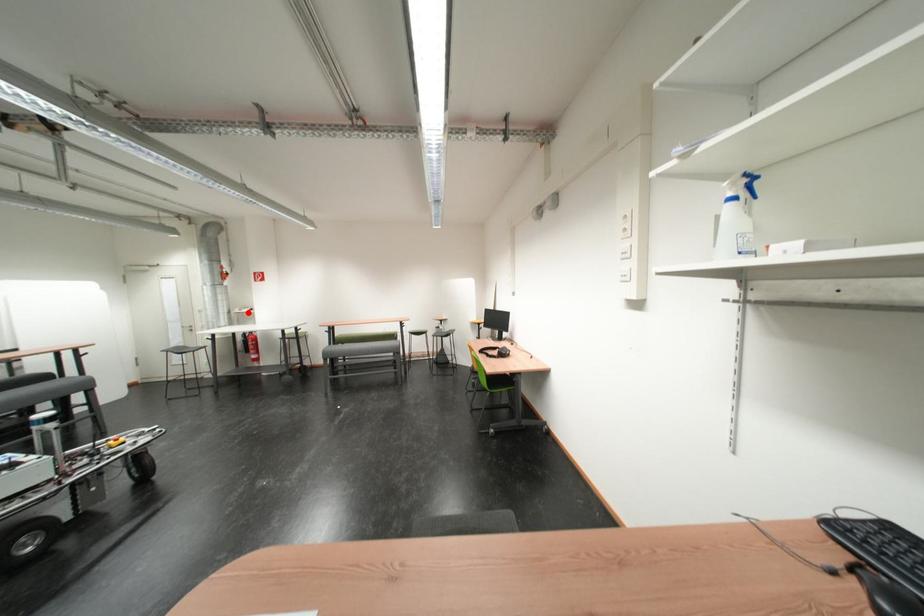
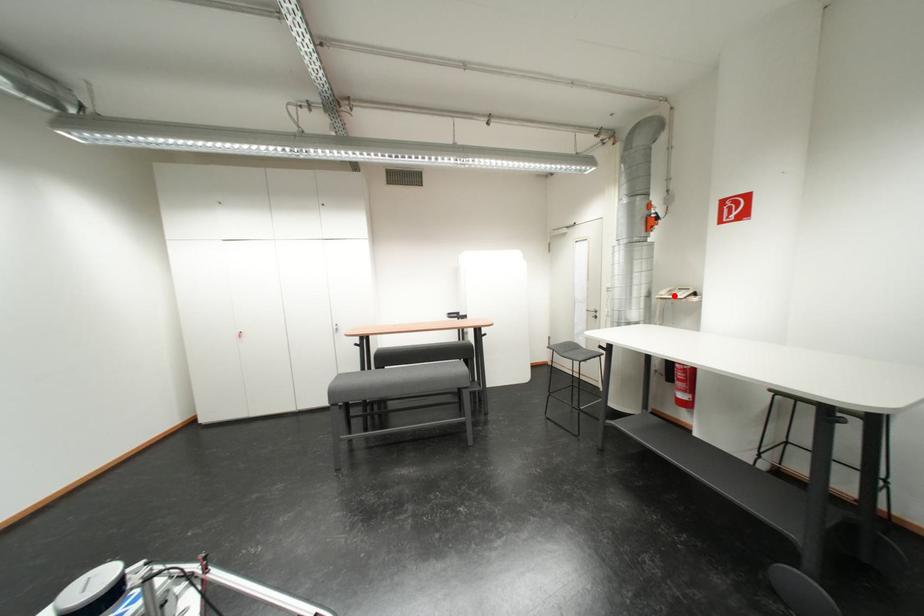
I am providing you with two images of the same scene from different viewpoints. A red point is marked on the first image and another point is marked on the second image. Does the point marked in image1 correspond to the same location as the one in image2?

Yes